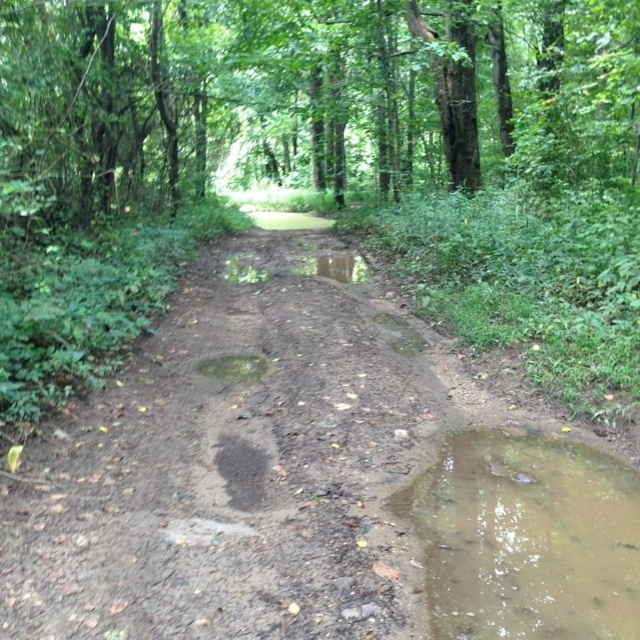
Question: Does green leafy tree at center have a lesser width compared to muddy water at center?

Choices:
 (A) yes
 (B) no

Answer: (B)

Question: Which point appears closest to the camera in this image?

Choices:
 (A) (556, 600)
 (B) (256, 378)
 (C) (410, 349)
 (D) (588, 136)

Answer: (A)

Question: Which of the following is the closest to the observer?

Choices:
 (A) muddy water at center
 (B) green leafy tree at center

Answer: (B)

Question: Which object is closer to the camera taking this photo?

Choices:
 (A) brown muddy dirt track at center
 (B) muddy water at center

Answer: (A)

Question: Is brown muddy dirt track at center to the left of muddy wet puddle at lower right from the viewer's perspective?

Choices:
 (A) no
 (B) yes

Answer: (B)

Question: In this image, where is muddy wet puddle at lower right located relative to muddy water at center?

Choices:
 (A) below
 (B) above

Answer: (A)